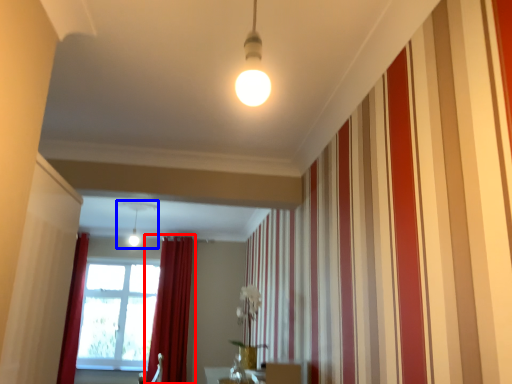
Question: Which object appears farthest to the camera in this image, curtain (highlighted by a red box) or light fixture (highlighted by a blue box)?

Choices:
 (A) curtain
 (B) light fixture

Answer: (A)